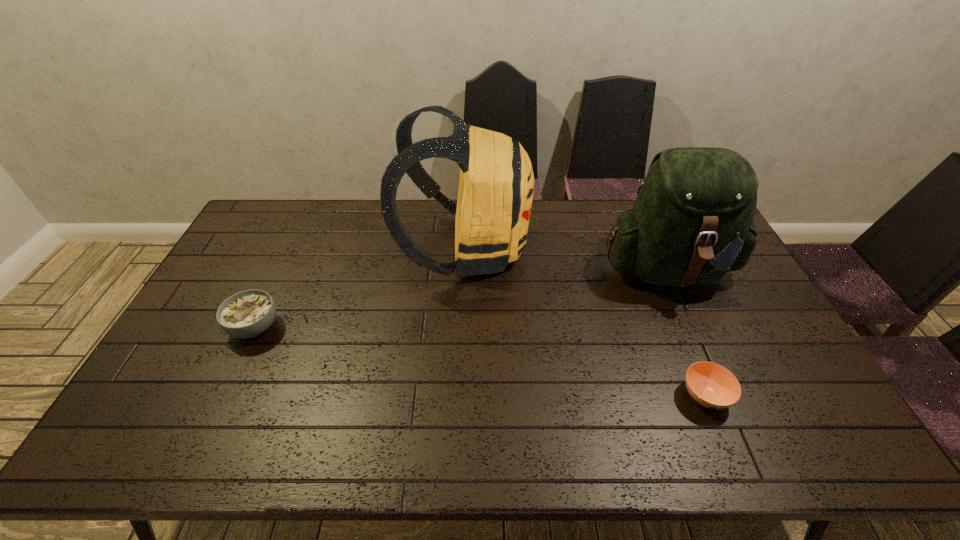
This screenshot has width=960, height=540. Find the location of `vacant point located between the taller soup bowl and the right backpack`. vacant point located between the taller soup bowl and the right backpack is located at coordinates (461, 297).

At what (x,y) coordinates should I click in order to perform the action: click on vacant space that's between the left soup bowl and the third object from right to left. Please return your answer as a coordinate pair (x, y). The image size is (960, 540). Looking at the image, I should click on (360, 288).

Find the location of a particular element. This screenshot has height=540, width=960. unoccupied position between the nearest object and the second shortest object is located at coordinates (480, 362).

Image resolution: width=960 pixels, height=540 pixels. I want to click on free space between the leftmost object and the shorter soup bowl, so click(480, 362).

Locate an element on the screen. This screenshot has width=960, height=540. vacant space in between the second object from left to right and the third tallest object is located at coordinates (360, 288).

This screenshot has height=540, width=960. I want to click on vacant space in between the second shortest object and the right backpack, so click(461, 297).

You are a GUI agent. You are given a task and a screenshot of the screen. Output one action in this format:
    pyautogui.click(x=<x>, y=<y>)
    Task: Click on the free space between the second object from left to right and the third tallest object
    This screenshot has width=960, height=540.
    Given the screenshot: What is the action you would take?
    pyautogui.click(x=360, y=288)

Where is `object that can be found as the second closest to the third object from right to left`? object that can be found as the second closest to the third object from right to left is located at coordinates (246, 314).

Locate which object is the closest to the nearer soup bowl. Please provide its 2D coordinates. Your answer should be formatted as a tuple, i.e. [(x, y)], where the tuple contains the x and y coordinates of a point satisfying the conditions above.

[(692, 222)]

Where is `free space that satisfies the following two spatial constraints: 1. on the front-facing side of the left backpack; 2. on the front side of the farther soup bowl`? This screenshot has width=960, height=540. free space that satisfies the following two spatial constraints: 1. on the front-facing side of the left backpack; 2. on the front side of the farther soup bowl is located at coordinates (462, 327).